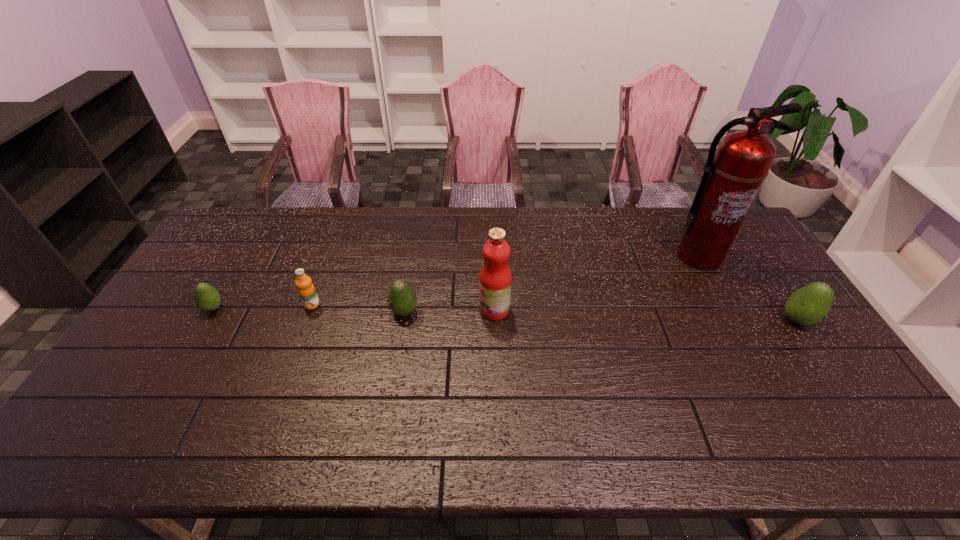
In order to click on object that is at the left edge in this screenshot , I will do coord(207,298).

Find the location of a particular element. The width and height of the screenshot is (960, 540). avocado present at the right edge is located at coordinates (808, 305).

What are the coordinates of `fire extinguisher that is at the right edge` in the screenshot? It's located at (733, 174).

Locate an element on the screen. The height and width of the screenshot is (540, 960). object that is positioned at the far right corner is located at coordinates (733, 174).

Where is `free location at the far edge of the desktop`? The height and width of the screenshot is (540, 960). free location at the far edge of the desktop is located at coordinates (310, 234).

I want to click on free space at the near edge of the desktop, so pyautogui.click(x=399, y=408).

This screenshot has width=960, height=540. In order to click on free space at the right edge in this screenshot , I will do `click(731, 271)`.

Identify the location of free space between the second object from left to right and the rightmost avocado. (555, 313).

The image size is (960, 540). What are the coordinates of `free space that is in between the leftmost avocado and the second object from left to right` in the screenshot? It's located at coord(263,306).

Find the location of a particular element. The height and width of the screenshot is (540, 960). free space that is in between the rightmost object and the second shortest avocado is located at coordinates (601, 316).